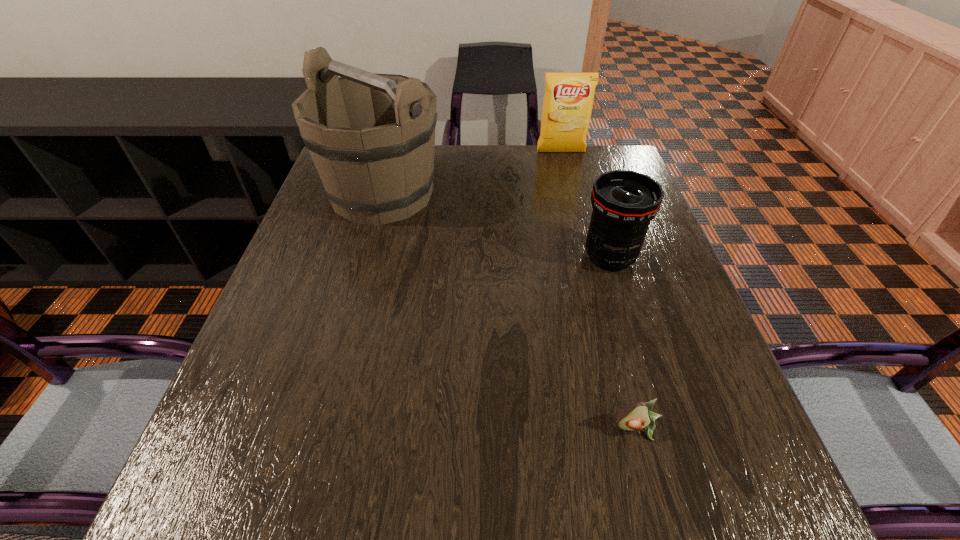
What are the coordinates of `blank space located 0.290m on the left of the third farthest object` in the screenshot? It's located at (454, 258).

Locate an element on the screen. The width and height of the screenshot is (960, 540). vacant position located 0.070m on the seed side of the avocado is located at coordinates (653, 486).

You are a GUI agent. You are given a task and a screenshot of the screen. Output one action in this format:
    pyautogui.click(x=<x>, y=<y>)
    Task: Click on the bucket that is at the far edge
    
    Given the screenshot: What is the action you would take?
    pyautogui.click(x=371, y=136)

Where is `crisp (potato chip) that is positioned at the far edge`? crisp (potato chip) that is positioned at the far edge is located at coordinates (567, 104).

Image resolution: width=960 pixels, height=540 pixels. I want to click on object that is at the left edge, so click(371, 136).

The image size is (960, 540). In order to click on crisp (potato chip) that is at the right edge in this screenshot , I will do `click(567, 104)`.

Locate an element on the screen. This screenshot has height=540, width=960. telephoto lens present at the right edge is located at coordinates (624, 202).

Identify the location of avocado that is at the right edge. This screenshot has width=960, height=540. 636,416.

Where is `object at the far left corner`? This screenshot has width=960, height=540. object at the far left corner is located at coordinates (371, 136).

Where is `object located at the far right corner`? This screenshot has width=960, height=540. object located at the far right corner is located at coordinates (567, 104).